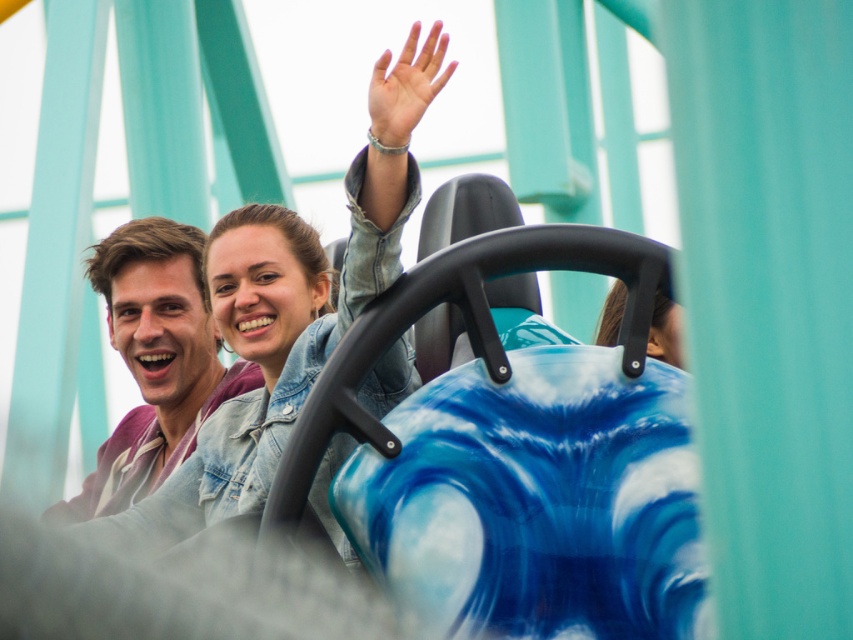
Question: Is denim jacket at upper center positioned behind matte purple shirt at left?

Choices:
 (A) yes
 (B) no

Answer: (B)

Question: Which of the following is the farthest from the observer?

Choices:
 (A) (163, 474)
 (B) (436, 72)

Answer: (A)

Question: Considering the relative positions of denim jacket at upper center and matte purple shirt at left in the image provided, where is denim jacket at upper center located with respect to matte purple shirt at left?

Choices:
 (A) left
 (B) right

Answer: (B)

Question: Which point is closer to the camera taking this photo?

Choices:
 (A) click(119, 342)
 (B) click(236, 336)

Answer: (B)

Question: Is denim jacket at upper center further to the viewer compared to matte purple shirt at left?

Choices:
 (A) no
 (B) yes

Answer: (A)

Question: Among these points, which one is farthest from the camera?

Choices:
 (A) (378, 150)
 (B) (144, 324)

Answer: (B)